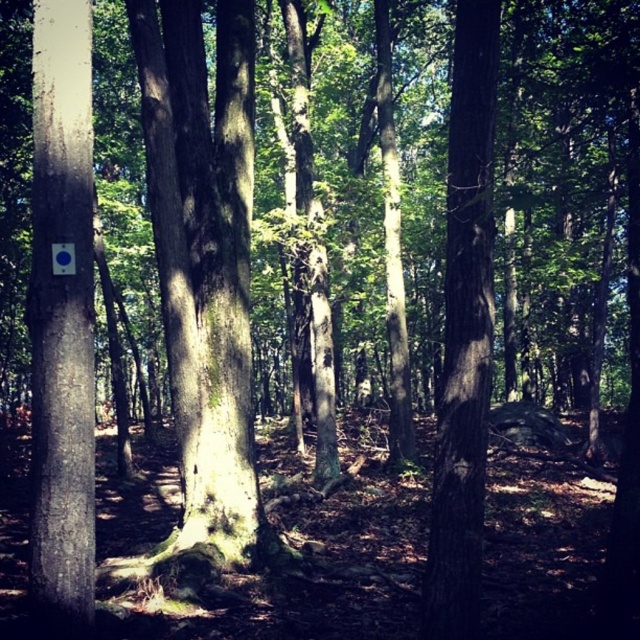
You are a hiker who wants to mark the highest point between the smooth gray bark at left and the smooth brown tree trunk at center. Which one should you choose?

The smooth gray bark at left is above the smooth brown tree trunk at center, so you should choose the smooth gray bark at left as the highest point.

You are a hiker trying to identify trees in the forest. You notice the smooth gray bark at left and the smooth brown tree trunk at center. Which tree has a wider trunk?

The smooth brown tree trunk at center has a wider trunk than the smooth gray bark at left.